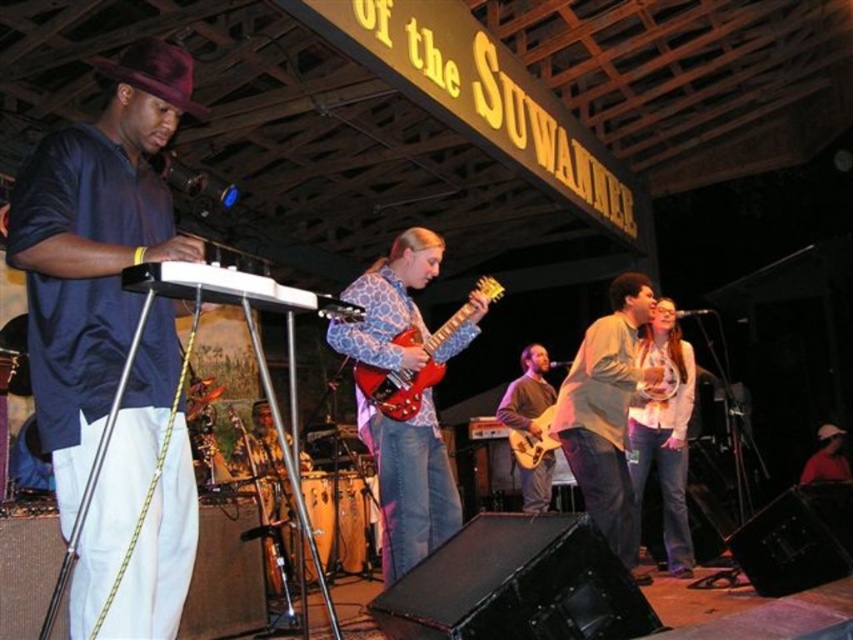
Question: Is brown sweater at center closer to camera compared to white matte baseball cap at lower right?

Choices:
 (A) yes
 (B) no

Answer: (A)

Question: Which object is positioned farthest from the white matte baseball cap at lower right?

Choices:
 (A) light brown textured shirt at center
 (B) patterned fabric guitar at center

Answer: (B)

Question: Among these points, which one is farthest from the camera?

Choices:
 (A) (828, 429)
 (B) (674, 376)
 (C) (392, 412)

Answer: (A)

Question: Is light brown leather jacket at center bigger than brown sweater at center?

Choices:
 (A) yes
 (B) no

Answer: (A)

Question: Which object appears farthest from the camera in this image?

Choices:
 (A) light brown wood electric guitar at center
 (B) matte blue shirt at left
 (C) light brown leather jacket at center
 (D) patterned fabric guitar at center

Answer: (A)

Question: Is patterned fabric guitar at center wider than glossy red electric guitar at center?

Choices:
 (A) yes
 (B) no

Answer: (A)